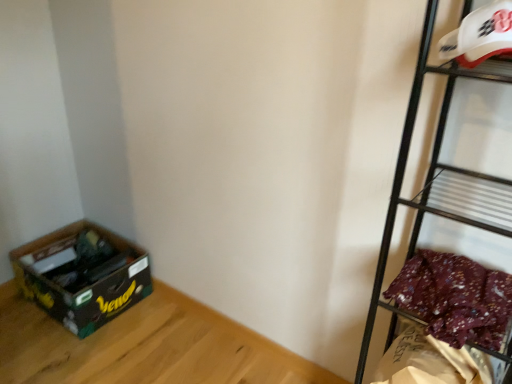
You are a GUI agent. You are given a task and a screenshot of the screen. Output one action in this format:
    pyautogui.click(x=<x>, y=<y>)
    Task: Click on the white plastic helmet at upper right, marked as the 1th shelf in a top-to-bottom arrangement
    This screenshot has width=512, height=384.
    Given the screenshot: What is the action you would take?
    pyautogui.click(x=460, y=53)

This screenshot has height=384, width=512. I want to click on floral fabric at right, so click(x=455, y=298).

Describe the element at coordinates (82, 275) in the screenshot. The width and height of the screenshot is (512, 384). I see `green cardboard box at lower left` at that location.

Where is `matte black box at lower left`? Image resolution: width=512 pixels, height=384 pixels. matte black box at lower left is located at coordinates (144, 347).

In order to click on white plastic helmet at upper right, marked as the 1th shelf in a top-to-bottom arrangement in this screenshot , I will do `click(460, 53)`.

From a real-world perspective, does floral fabric at right stand above white plastic helmet at upper right, marked as the 2th shelf in a bottom-to-top arrangement?

No.

Could you tell me if floral fabric at right is turned towards white plastic helmet at upper right, marked as the 2th shelf in a bottom-to-top arrangement?

No, floral fabric at right is not facing towards white plastic helmet at upper right, marked as the 2th shelf in a bottom-to-top arrangement.

Is floral fabric at right taller or shorter than white plastic helmet at upper right, marked as the 1th shelf in a top-to-bottom arrangement?

In the image, floral fabric at right appears to be shorter than white plastic helmet at upper right, marked as the 1th shelf in a top-to-bottom arrangement.

Is floral fabric at right beside white plastic helmet at upper right, marked as the 2th shelf in a bottom-to-top arrangement?

No, floral fabric at right is not touching white plastic helmet at upper right, marked as the 2th shelf in a bottom-to-top arrangement.

Do you think metallic black shelf at right, the 2th shelf positioned from the top, is within floral fabric at right, or outside of it?

metallic black shelf at right, the 2th shelf positioned from the top, is not enclosed by floral fabric at right.

Is metallic black shelf at right, the 2th shelf positioned from the top, facing away from floral fabric at right?

Yes, metallic black shelf at right, the 2th shelf positioned from the top, is positioned with its back facing floral fabric at right.

From a real-world perspective, is metallic black shelf at right, the 2th shelf positioned from the top, physically above floral fabric at right?

No.

Considering the relative positions of matte black box at lower left and white plastic helmet at upper right, marked as the 2th shelf in a bottom-to-top arrangement, in the image provided, is matte black box at lower left in front of white plastic helmet at upper right, marked as the 2th shelf in a bottom-to-top arrangement,?

No, it is not.

Does matte black box at lower left have a greater width compared to white plastic helmet at upper right, marked as the 1th shelf in a top-to-bottom arrangement?

Yes, matte black box at lower left is wider than white plastic helmet at upper right, marked as the 1th shelf in a top-to-bottom arrangement.

Is white plastic helmet at upper right, marked as the 2th shelf in a bottom-to-top arrangement, completely or partially inside matte black box at lower left?

That's incorrect, white plastic helmet at upper right, marked as the 2th shelf in a bottom-to-top arrangement, is not inside matte black box at lower left.

Can you tell me how much matte black box at lower left and white plastic helmet at upper right, marked as the 1th shelf in a top-to-bottom arrangement, differ in facing direction?

114 degrees.

Is matte black box at lower left located outside floral fabric at right?

Yes, matte black box at lower left is not within floral fabric at right.

Locate an element on the screen. This screenshot has width=512, height=384. clothing on the right of matte black box at lower left is located at coordinates (455, 298).

Who is bigger, matte black box at lower left or floral fabric at right?

With larger size is matte black box at lower left.

Based on the photo, between matte black box at lower left and floral fabric at right, which one appears on the right side from the viewer's perspective?

floral fabric at right is more to the right.

Can you see green cardboard box at lower left touching floral fabric at right?

There is a gap between green cardboard box at lower left and floral fabric at right.

Is green cardboard box at lower left further to the viewer compared to floral fabric at right?

Yes, the depth of green cardboard box at lower left is greater than that of floral fabric at right.

Is green cardboard box at lower left positioned beyond the bounds of floral fabric at right?

Yes, green cardboard box at lower left is outside of floral fabric at right.

Could you tell me if green cardboard box at lower left is facing floral fabric at right?

No.

Does point (404, 284) come farther from viewer compared to point (451, 234)?

No, it is in front of (451, 234).

Considering the relative sizes of floral fabric at right and metallic black shelf at right, the 2th shelf positioned from the top, in the image provided, is floral fabric at right taller than metallic black shelf at right, the 2th shelf positioned from the top,?

In fact, floral fabric at right may be shorter than metallic black shelf at right, the 2th shelf positioned from the top.

Consider the image. Does floral fabric at right contain metallic black shelf at right, which appears as the 1th shelf when ordered from the bottom?

No, metallic black shelf at right, which appears as the 1th shelf when ordered from the bottom, is not surrounded by floral fabric at right.

Does floral fabric at right come in front of metallic black shelf at right, the 2th shelf positioned from the top?

That is False.

Is metallic black shelf at right, which appears as the 1th shelf when ordered from the bottom, turned away from matte black box at lower left?

No, metallic black shelf at right, which appears as the 1th shelf when ordered from the bottom,'s orientation is not away from matte black box at lower left.

Could you measure the distance between metallic black shelf at right, which appears as the 1th shelf when ordered from the bottom, and matte black box at lower left?

metallic black shelf at right, which appears as the 1th shelf when ordered from the bottom, and matte black box at lower left are 34.67 inches apart from each other.

Is metallic black shelf at right, the 2th shelf positioned from the top, not near matte black box at lower left?

metallic black shelf at right, the 2th shelf positioned from the top, is actually quite close to matte black box at lower left.

Locate an element on the screen. the 1st shelf in front when counting from the floral fabric at right is located at coordinates (460, 53).

This screenshot has width=512, height=384. In the image, there is a floral fabric at right. Identify the location of shelf below it (from a real-world perspective). (453, 175).

From the image, which object appears to be nearer to green cardboard box at lower left, floral fabric at right or matte black box at lower left?

matte black box at lower left lies closer to green cardboard box at lower left than the other object.

From the image, which object appears to be farther from matte black box at lower left, green cardboard box at lower left or white plastic helmet at upper right, marked as the 2th shelf in a bottom-to-top arrangement?

white plastic helmet at upper right, marked as the 2th shelf in a bottom-to-top arrangement, is further to matte black box at lower left.

Which object lies further to the anchor point metallic black shelf at right, which appears as the 1th shelf when ordered from the bottom, green cardboard box at lower left or floral fabric at right?

The object further to metallic black shelf at right, which appears as the 1th shelf when ordered from the bottom, is green cardboard box at lower left.

From the image, which object appears to be nearer to white plastic helmet at upper right, marked as the 1th shelf in a top-to-bottom arrangement, matte black box at lower left or metallic black shelf at right, which appears as the 1th shelf when ordered from the bottom?

The object closer to white plastic helmet at upper right, marked as the 1th shelf in a top-to-bottom arrangement, is metallic black shelf at right, which appears as the 1th shelf when ordered from the bottom.

Estimate the real-world distances between objects in this image. Which object is closer to white plastic helmet at upper right, marked as the 2th shelf in a bottom-to-top arrangement, green cardboard box at lower left or metallic black shelf at right, the 2th shelf positioned from the top?

metallic black shelf at right, the 2th shelf positioned from the top.

Estimate the real-world distances between objects in this image. Which object is further from floral fabric at right, green cardboard box at lower left or matte black box at lower left?

green cardboard box at lower left is further to floral fabric at right.

Considering their positions, is floral fabric at right positioned further to matte black box at lower left than green cardboard box at lower left?

Based on the image, floral fabric at right appears to be further to matte black box at lower left.

From the image, which object appears to be farther from white plastic helmet at upper right, marked as the 2th shelf in a bottom-to-top arrangement, floral fabric at right or metallic black shelf at right, the 2th shelf positioned from the top?

floral fabric at right.

You are a GUI agent. You are given a task and a screenshot of the screen. Output one action in this format:
    pyautogui.click(x=<x>, y=<y>)
    Task: Click on the clothing between matte black box at lower left and metallic black shelf at right, which appears as the 1th shelf when ordered from the bottom, in the horizontal direction
    
    Given the screenshot: What is the action you would take?
    pyautogui.click(x=455, y=298)

Image resolution: width=512 pixels, height=384 pixels. What are the coordinates of `shelf between matte black box at lower left and metallic black shelf at right, which appears as the 1th shelf when ordered from the bottom, in the horizontal direction` in the screenshot? It's located at (460, 53).

The width and height of the screenshot is (512, 384). I want to click on clothing between white plastic helmet at upper right, marked as the 2th shelf in a bottom-to-top arrangement, and metallic black shelf at right, the 2th shelf positioned from the top, vertically, so click(x=455, y=298).

Locate an element on the screen. furniture between green cardboard box at lower left and white plastic helmet at upper right, marked as the 2th shelf in a bottom-to-top arrangement, in the horizontal direction is located at coordinates (144, 347).